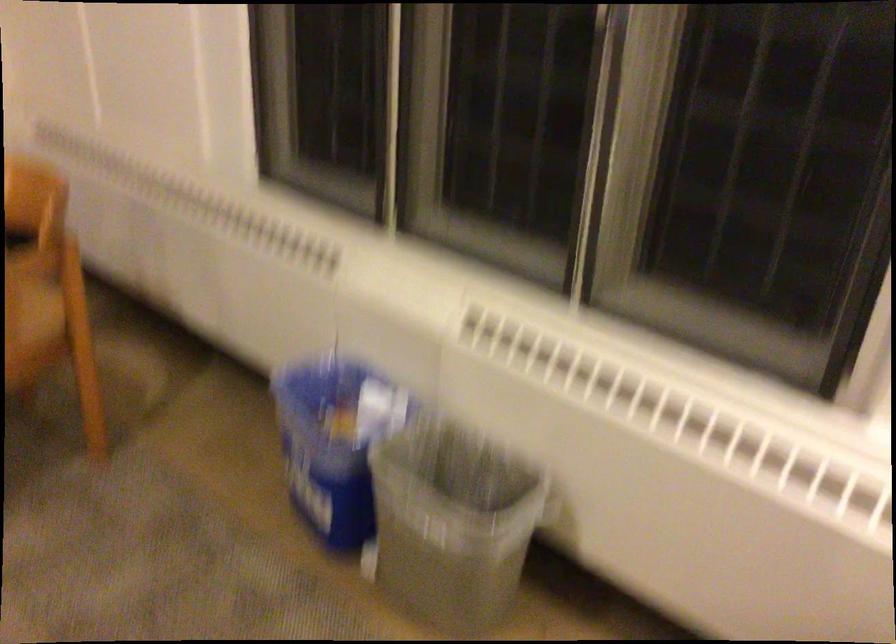
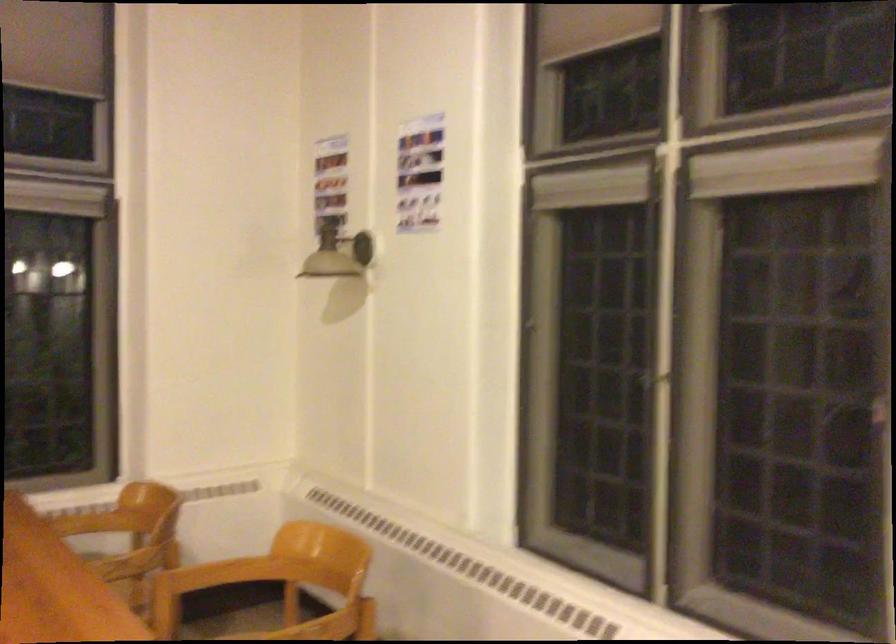
Question: The images are taken continuously from a first-person perspective. In which direction is your viewpoint rotating?

Choices:
 (A) Left
 (B) Right
 (C) Up
 (D) Down

Answer: (C)